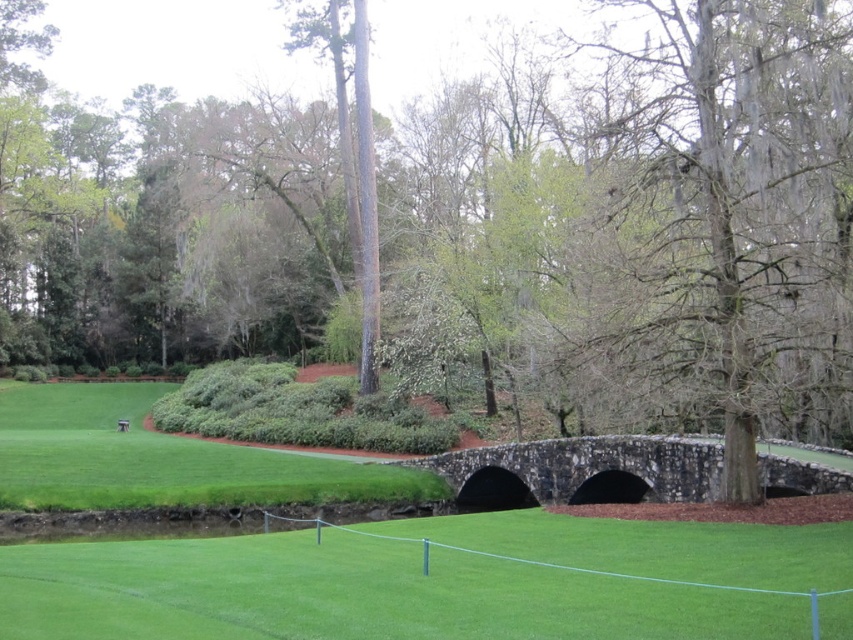
Question: Which is nearer to the dark gray stone bridge at center?

Choices:
 (A) green smooth grass at center
 (B) gray mossy tree trunk at center

Answer: (B)

Question: Which object appears farthest from the camera in this image?

Choices:
 (A) gray mossy tree trunk at center
 (B) green smooth grass at center
 (C) dark gray stone bridge at center

Answer: (C)

Question: Does gray mossy tree trunk at center have a greater width compared to dark gray stone bridge at center?

Choices:
 (A) no
 (B) yes

Answer: (B)

Question: Is gray mossy tree trunk at center closer to camera compared to green smooth grass at center?

Choices:
 (A) yes
 (B) no

Answer: (B)

Question: Considering the real-world distances, which object is farthest from the gray mossy tree trunk at center?

Choices:
 (A) dark gray stone bridge at center
 (B) green smooth grass at center

Answer: (B)

Question: Is gray mossy tree trunk at center closer to the viewer compared to green smooth grass at center?

Choices:
 (A) yes
 (B) no

Answer: (B)